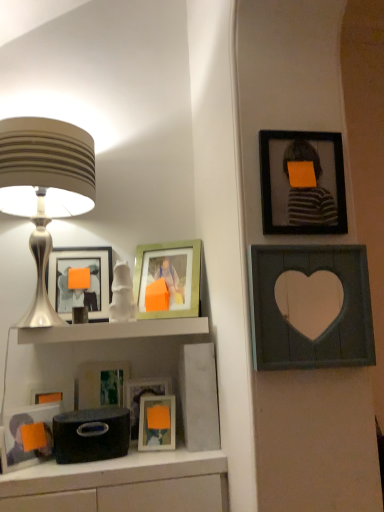
Question: Does silver metallic lampshade at left have a lesser height compared to matte glass picture frame at lower center, acting as the 4th picture frame starting from the right?

Choices:
 (A) yes
 (B) no

Answer: (B)

Question: Would you say silver metallic lampshade at left is outside matte glass picture frame at lower center, acting as the 4th picture frame starting from the right?

Choices:
 (A) yes
 (B) no

Answer: (A)

Question: Is silver metallic lampshade at left positioned with its back to matte glass picture frame at lower center, which is counted as the fourth picture frame, starting from the left?

Choices:
 (A) no
 (B) yes

Answer: (A)

Question: Is silver metallic lampshade at left not close to matte glass picture frame at lower center, which is counted as the fourth picture frame, starting from the left?

Choices:
 (A) yes
 (B) no

Answer: (B)

Question: Does silver metallic lampshade at left have a greater height compared to matte glass picture frame at lower center, acting as the 4th picture frame starting from the right?

Choices:
 (A) no
 (B) yes

Answer: (B)

Question: In terms of width, does wooden heart-shaped frame at upper right, marked as the 7th picture frame in a left-to-right arrangement, look wider or thinner when compared to silver metallic lampshade at left?

Choices:
 (A) thin
 (B) wide

Answer: (A)

Question: Considering the positions of wooden heart-shaped frame at upper right, arranged as the 1th picture frame when viewed from the right, and silver metallic lampshade at left in the image, is wooden heart-shaped frame at upper right, arranged as the 1th picture frame when viewed from the right, bigger or smaller than silver metallic lampshade at left?

Choices:
 (A) small
 (B) big

Answer: (A)

Question: From a real-world perspective, is wooden heart-shaped frame at upper right, arranged as the 1th picture frame when viewed from the right, positioned above or below silver metallic lampshade at left?

Choices:
 (A) above
 (B) below

Answer: (B)

Question: Is wooden heart-shaped frame at upper right, marked as the 7th picture frame in a left-to-right arrangement, spatially inside silver metallic lampshade at left, or outside of it?

Choices:
 (A) outside
 (B) inside

Answer: (A)

Question: Is matte orange picture frame at center, the third picture frame from the right, situated inside wooden heart-shaped frame at upper right, arranged as the 1th picture frame when viewed from the right, or outside?

Choices:
 (A) inside
 (B) outside

Answer: (B)

Question: From the image's perspective, is matte orange picture frame at center, the third picture frame from the right, located above or below wooden heart-shaped frame at upper right, marked as the 7th picture frame in a left-to-right arrangement?

Choices:
 (A) below
 (B) above

Answer: (A)

Question: In terms of height, does matte orange picture frame at center, the third picture frame from the right, look taller or shorter compared to wooden heart-shaped frame at upper right, arranged as the 1th picture frame when viewed from the right?

Choices:
 (A) short
 (B) tall

Answer: (A)

Question: Is point (150, 420) positioned closer to the camera than point (294, 358)?

Choices:
 (A) farther
 (B) closer

Answer: (A)

Question: In terms of width, does white glossy shelf at center look wider or thinner when compared to wooden heart-shaped frame at upper right, arranged as the 1th picture frame when viewed from the right?

Choices:
 (A) thin
 (B) wide

Answer: (B)

Question: Relative to wooden heart-shaped frame at upper right, marked as the 7th picture frame in a left-to-right arrangement, is white glossy shelf at center in front or behind?

Choices:
 (A) front
 (B) behind

Answer: (B)